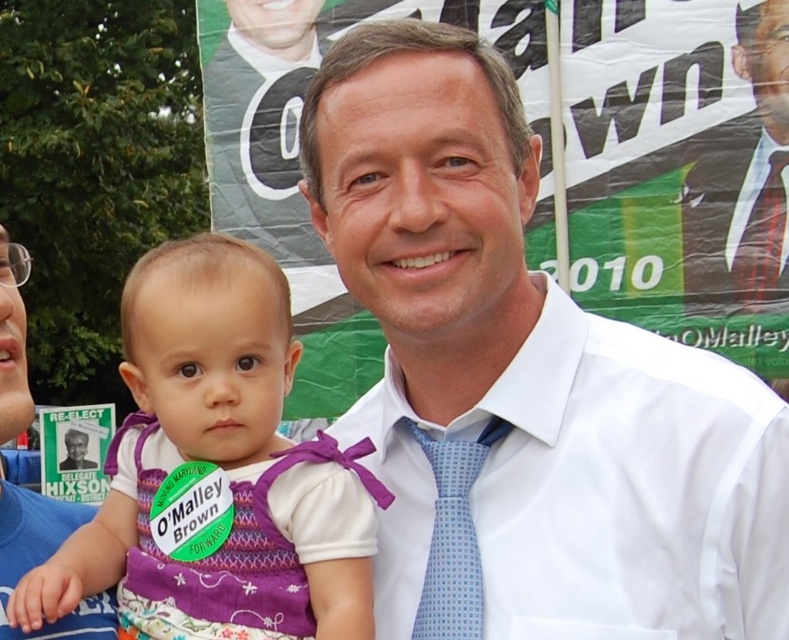
You are a photographer at a political event. You need to ensure that the purple fabric dress at center and white shirt at center are both visible in the photo. Given their sizes, which object might require you to adjust your camera angle to include it fully?

The purple fabric dress at center has a larger width than the white shirt at center, so you might need to adjust your camera angle to ensure the purple fabric dress at center is fully visible in the photo.

You are a photographer at a political event. You need to position the camera so that the purple fabric dress at center and the smooth black suit at center are both visible. Which object should be placed to the right side of the camera frame to ensure both are visible?

The smooth black suit at center should be placed to the right side of the camera frame because the purple fabric dress at center is to the left of the smooth black suit at center. This arrangement ensures both objects are visible in the frame.

You are a photographer at the event and need to adjust your focus. Which of the two points, point (x=690, y=483) or point (x=757, y=285), is closer to you?

Point (x=690, y=483) is closer to the viewer than point (x=757, y=285).